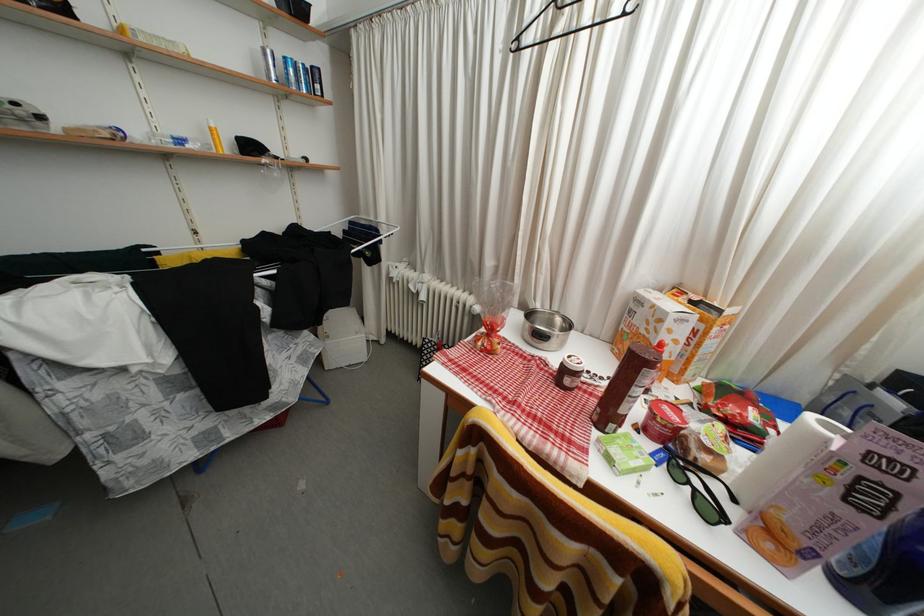
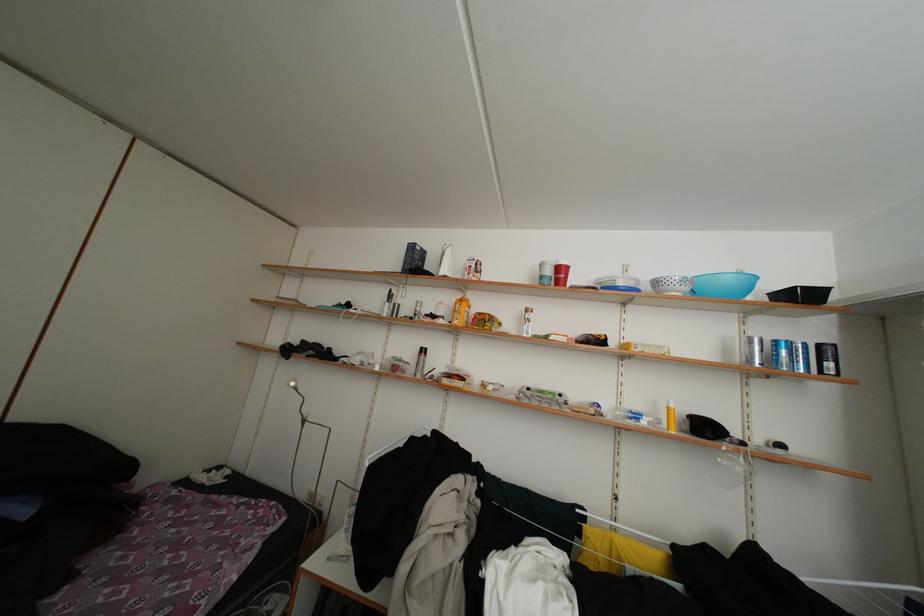
The first image is from the beginning of the video and the second image is from the end. How did the camera likely rotate when shooting the video?

The rotation direction of the camera is left-up.